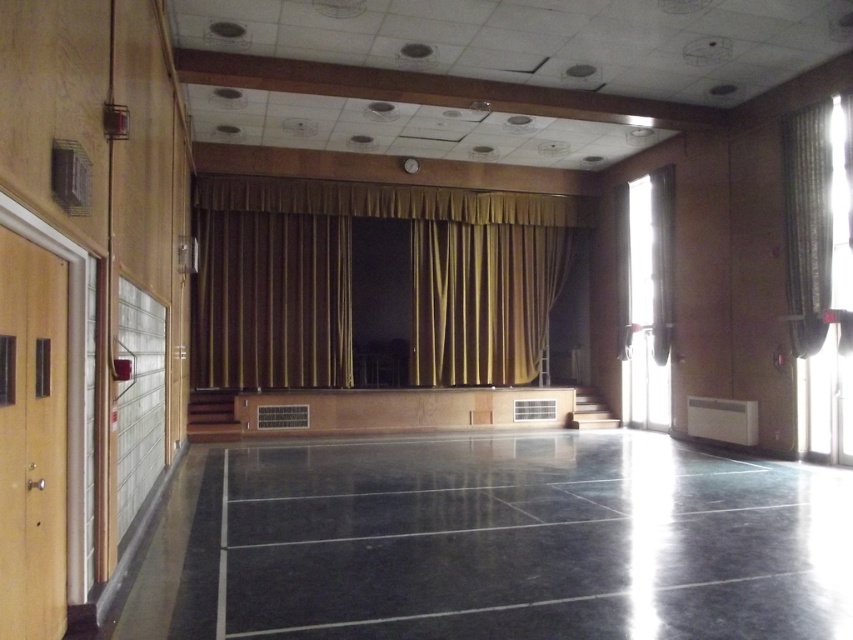
Does black polished floor at center have a greater width compared to gold textured curtain at right?

Yes.

Can you confirm if black polished floor at center is positioned above gold textured curtain at right?

Actually, black polished floor at center is below gold textured curtain at right.

Does point (680, 470) come in front of point (822, 221)?

Yes, it is in front of point (822, 221).

Locate an element on the screen. black polished floor at center is located at coordinates (495, 544).

Who is positioned more to the right, gold fabric curtain at center or gold textured curtain at right?

Positioned to the right is gold textured curtain at right.

Identify the location of gold fabric curtain at center. This screenshot has height=640, width=853. (350, 280).

Who is more distant from viewer, (537, 241) or (811, 202)?

The point (537, 241) is more distant.

You are a GUI agent. You are given a task and a screenshot of the screen. Output one action in this format:
    pyautogui.click(x=<x>, y=<y>)
    Task: Click on the gold fabric curtain at center
    The height and width of the screenshot is (640, 853).
    Given the screenshot: What is the action you would take?
    pyautogui.click(x=350, y=280)

Measure the distance between black polished floor at center and gold fabric curtain at center.

29.02 feet

Which is more to the left, black polished floor at center or gold fabric curtain at center?

Positioned to the left is gold fabric curtain at center.

Where is `black polished floor at center`? This screenshot has width=853, height=640. black polished floor at center is located at coordinates (495, 544).

The height and width of the screenshot is (640, 853). What are the coordinates of `black polished floor at center` in the screenshot? It's located at (495, 544).